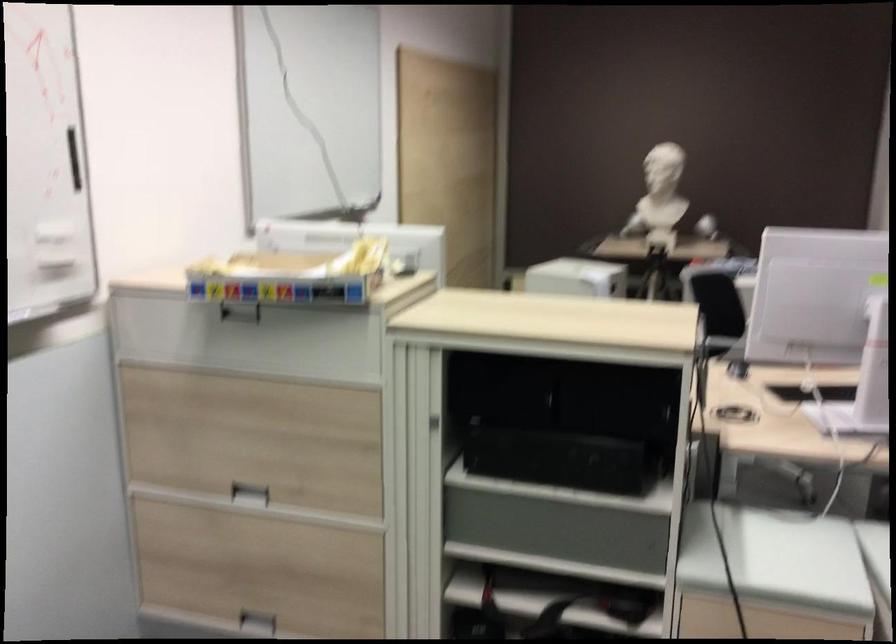
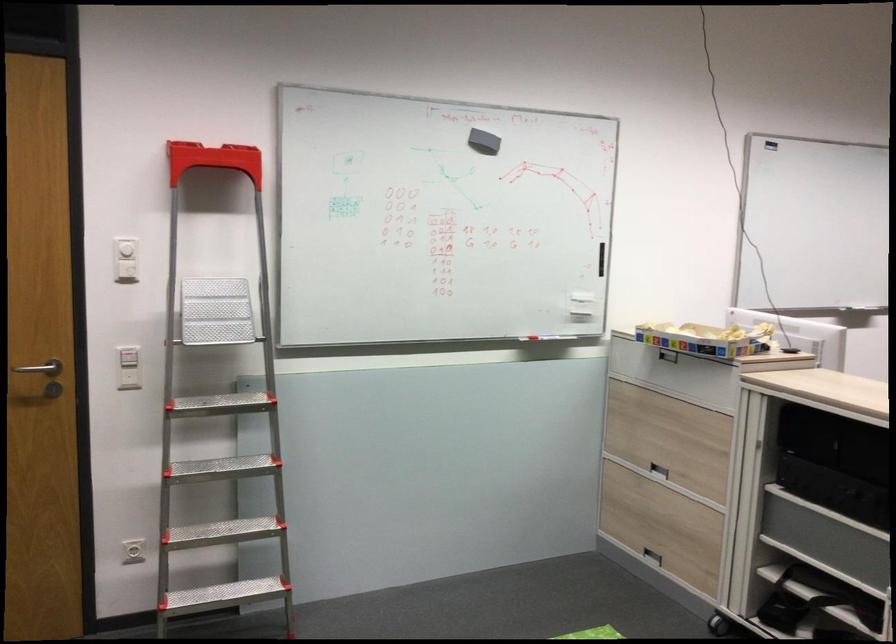
In the second image, find the point that corresponds to point 247,323 in the first image.

(668, 355)